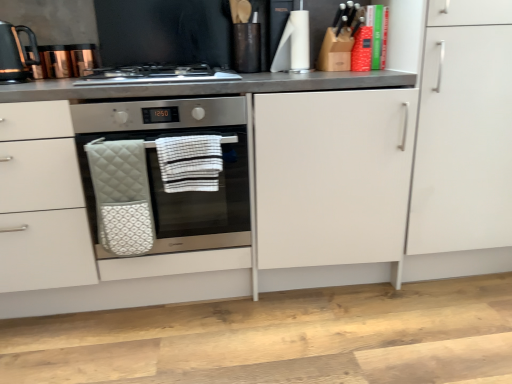
Question: Is stainless steel gas stove at center to the right of quilted white oven mitt at center, arranged as the 2th hand towel when viewed from the right, from the viewer's perspective?

Choices:
 (A) yes
 (B) no

Answer: (A)

Question: Could you tell me if stainless steel gas stove at center is facing quilted white oven mitt at center, arranged as the 2th hand towel when viewed from the right?

Choices:
 (A) yes
 (B) no

Answer: (B)

Question: Can you confirm if stainless steel gas stove at center is bigger than quilted white oven mitt at center, arranged as the 2th hand towel when viewed from the right?

Choices:
 (A) yes
 (B) no

Answer: (A)

Question: Considering the relative sizes of stainless steel gas stove at center and quilted white oven mitt at center, which is the 1th hand towel in left-to-right order, in the image provided, is stainless steel gas stove at center taller than quilted white oven mitt at center, which is the 1th hand towel in left-to-right order,?

Choices:
 (A) no
 (B) yes

Answer: (A)

Question: Is stainless steel gas stove at center thinner than quilted white oven mitt at center, arranged as the 2th hand towel when viewed from the right?

Choices:
 (A) no
 (B) yes

Answer: (A)

Question: Can you confirm if stainless steel gas stove at center is smaller than quilted white oven mitt at center, arranged as the 2th hand towel when viewed from the right?

Choices:
 (A) no
 (B) yes

Answer: (A)

Question: Considering the relative sizes of stainless steel gas stove at center and white matte cabinet at right in the image provided, is stainless steel gas stove at center smaller than white matte cabinet at right?

Choices:
 (A) no
 (B) yes

Answer: (B)

Question: Does stainless steel gas stove at center appear on the left side of white matte cabinet at right?

Choices:
 (A) no
 (B) yes

Answer: (B)

Question: Is stainless steel gas stove at center taller than white matte cabinet at right?

Choices:
 (A) yes
 (B) no

Answer: (B)

Question: Is stainless steel gas stove at center far from white matte cabinet at right?

Choices:
 (A) yes
 (B) no

Answer: (B)

Question: Considering the relative sizes of stainless steel gas stove at center and white matte cabinet at right in the image provided, is stainless steel gas stove at center thinner than white matte cabinet at right?

Choices:
 (A) yes
 (B) no

Answer: (A)

Question: Is stainless steel gas stove at center not inside white matte cabinet at right?

Choices:
 (A) yes
 (B) no

Answer: (A)

Question: From a real-world perspective, is white striped fabric hand towel at center, arranged as the first hand towel when viewed from the right, located beneath black glossy kettle at upper left?

Choices:
 (A) no
 (B) yes

Answer: (B)